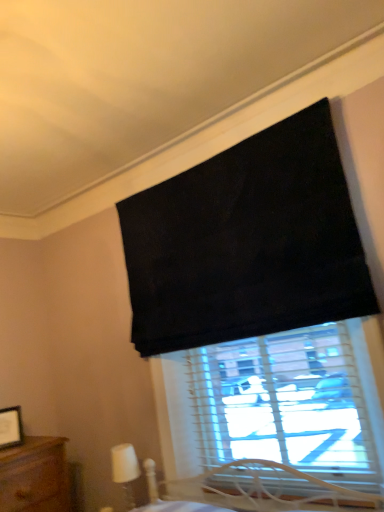
Question: Is wooden picture frame at lower left bigger or smaller than white plastic table lamp at lower left?

Choices:
 (A) big
 (B) small

Answer: (B)

Question: From a real-world perspective, is wooden picture frame at lower left above or below white plastic table lamp at lower left?

Choices:
 (A) above
 (B) below

Answer: (A)

Question: Considering their positions, is wooden picture frame at lower left located in front of or behind white plastic table lamp at lower left?

Choices:
 (A) behind
 (B) front

Answer: (A)

Question: From a real-world perspective, is white plastic table lamp at lower left positioned above or below wooden picture frame at lower left?

Choices:
 (A) above
 (B) below

Answer: (B)

Question: Is white plastic table lamp at lower left to the left or to the right of wooden picture frame at lower left in the image?

Choices:
 (A) left
 (B) right

Answer: (B)

Question: In terms of width, does white plastic table lamp at lower left look wider or thinner when compared to wooden picture frame at lower left?

Choices:
 (A) thin
 (B) wide

Answer: (B)

Question: Considering the positions of point (122, 477) and point (3, 420), is point (122, 477) closer or farther from the camera than point (3, 420)?

Choices:
 (A) closer
 (B) farther

Answer: (B)